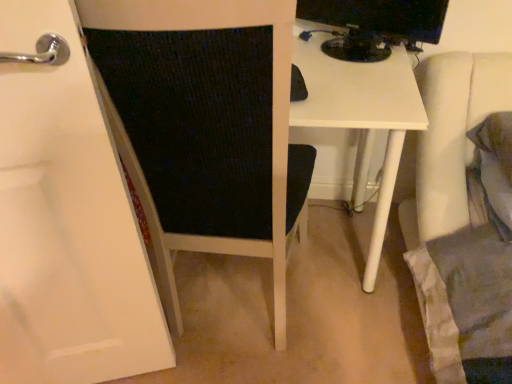
Where is `vacant area situated below black fabric chair at left (from a real-world perspective)`? The width and height of the screenshot is (512, 384). vacant area situated below black fabric chair at left (from a real-world perspective) is located at coordinates (297, 252).